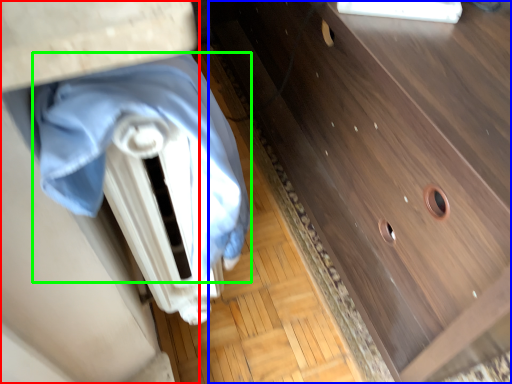
Question: Based on their relative distances, which object is nearer to vanity (highlighted by a red box)? Choose from chest of drawers (highlighted by a blue box) and blanket (highlighted by a green box).

Choices:
 (A) chest of drawers
 (B) blanket

Answer: (B)